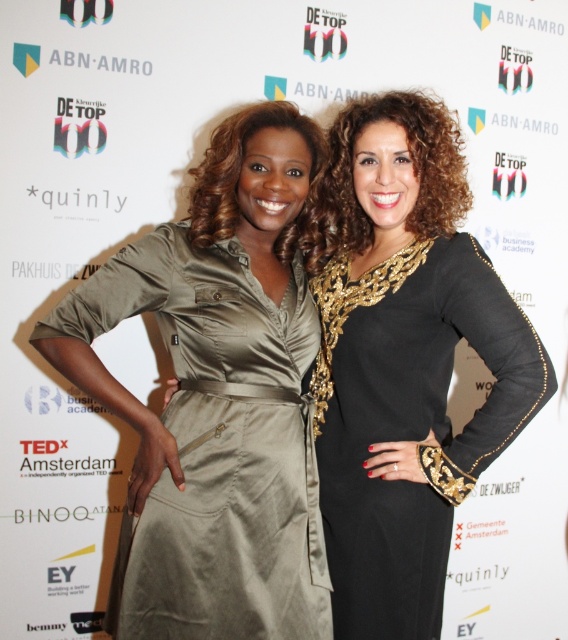
You are a photographer at an event with two women wearing the satin olive dress at center and the black sequined dress at right. You need to frame a photo so both dresses are visible. Which dress should you focus on to ensure both are in the frame without cropping?

The satin olive dress at center is not as tall as the black sequined dress at right, so you should focus on the taller black sequined dress at right to ensure both are visible in the frame without cropping.

You are at a networking event and want to approach the woman wearing the satin olive dress at center. According to the coordinates provided, where exactly should you look to find her?

The satin olive dress at center is located at coordinates point (x=216, y=445).

You are a photographer setting up for a photoshoot with two models wearing the satin olive dress at center and the black sequined dress at right. The camera requires a minimum distance of 8 inches between subjects to focus properly. Will the current positioning allow the camera to focus on both models?

The satin olive dress at center is 9.18 inches from the black sequined dress at right, which is more than the required 8 inches. Therefore, the camera can focus on both models.